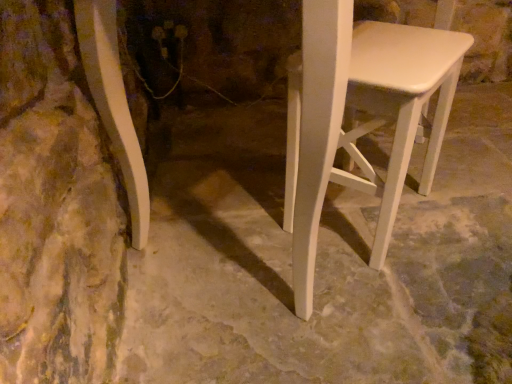
Question: Is white matte stool at right far away from white matte concrete at center?

Choices:
 (A) yes
 (B) no

Answer: (B)

Question: Could you tell me if white matte stool at right is facing white matte concrete at center?

Choices:
 (A) yes
 (B) no

Answer: (B)

Question: From a real-world perspective, is white matte stool at right positioned under white matte concrete at center based on gravity?

Choices:
 (A) yes
 (B) no

Answer: (B)

Question: Is white matte stool at right behind white matte concrete at center?

Choices:
 (A) no
 (B) yes

Answer: (B)

Question: Does white matte stool at right have a smaller size compared to white matte concrete at center?

Choices:
 (A) no
 (B) yes

Answer: (B)

Question: Does white matte stool at right have a greater height compared to white matte concrete at center?

Choices:
 (A) yes
 (B) no

Answer: (A)

Question: From a real-world perspective, is white matte concrete at center over white matte stool at right?

Choices:
 (A) yes
 (B) no

Answer: (B)

Question: Is white matte stool at right located within white matte concrete at center?

Choices:
 (A) no
 (B) yes

Answer: (A)

Question: Can you confirm if white matte concrete at center is thinner than white matte stool at right?

Choices:
 (A) yes
 (B) no

Answer: (B)

Question: Are white matte concrete at center and white matte stool at right far apart?

Choices:
 (A) no
 (B) yes

Answer: (A)

Question: Are white matte concrete at center and white matte stool at right beside each other?

Choices:
 (A) no
 (B) yes

Answer: (A)

Question: From the image's perspective, does white matte concrete at center appear higher than white matte stool at right?

Choices:
 (A) no
 (B) yes

Answer: (A)

Question: From a real-world perspective, relative to white matte stool at right, is white matte concrete at center vertically above or below?

Choices:
 (A) above
 (B) below

Answer: (B)